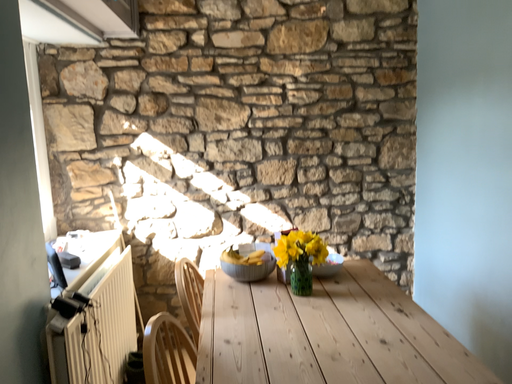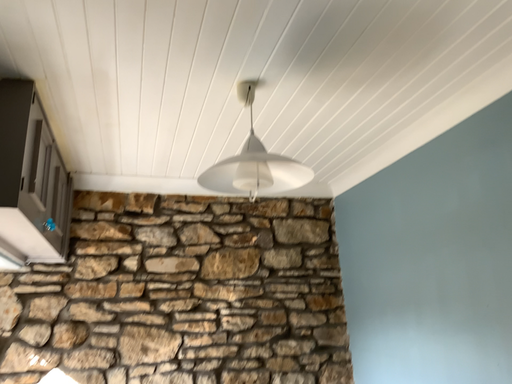
Question: Which way did the camera rotate in the video?

Choices:
 (A) rotated downward
 (B) rotated upward

Answer: (B)